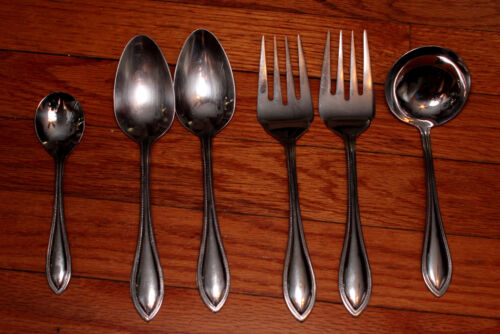
Find the location of a particular element. This screenshot has width=500, height=334. spots on utensils is located at coordinates (369, 125), (226, 105), (232, 103), (228, 98), (164, 122), (166, 113), (132, 129), (261, 89).